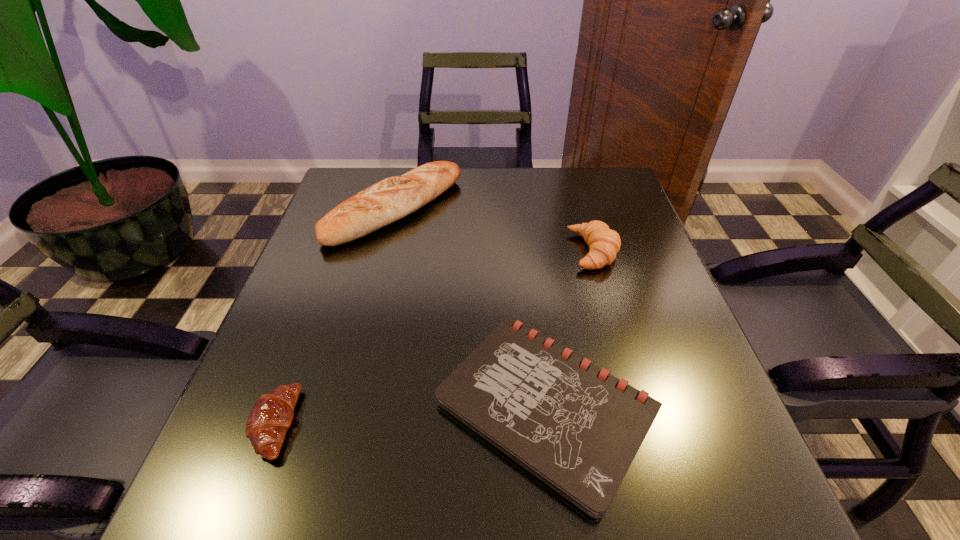
Where is `baguet`? This screenshot has height=540, width=960. baguet is located at coordinates (393, 198).

At what (x,y) coordinates should I click in order to perform the action: click on the right crescent roll. Please return your answer as a coordinate pair (x, y). The height and width of the screenshot is (540, 960). Looking at the image, I should click on (604, 243).

Identify the location of the second tallest object. Image resolution: width=960 pixels, height=540 pixels. [604, 243].

Image resolution: width=960 pixels, height=540 pixels. Find the location of `the left crescent roll`. the left crescent roll is located at coordinates (271, 416).

I want to click on the third tallest object, so [271, 416].

At what (x,y) coordinates should I click in order to perform the action: click on the shortest object. Please return your answer as a coordinate pair (x, y). The height and width of the screenshot is (540, 960). Looking at the image, I should click on pyautogui.click(x=577, y=428).

This screenshot has height=540, width=960. I want to click on blank space located on the right of the baguet, so click(481, 210).

The height and width of the screenshot is (540, 960). In order to click on free spot located on the front of the farther crescent roll in this screenshot , I will do `click(607, 295)`.

Where is `free region located 0.080m on the right of the nearer crescent roll`? free region located 0.080m on the right of the nearer crescent roll is located at coordinates (344, 424).

Identify the location of vacant position located 0.160m on the back of the shortest object. The width and height of the screenshot is (960, 540). (530, 272).